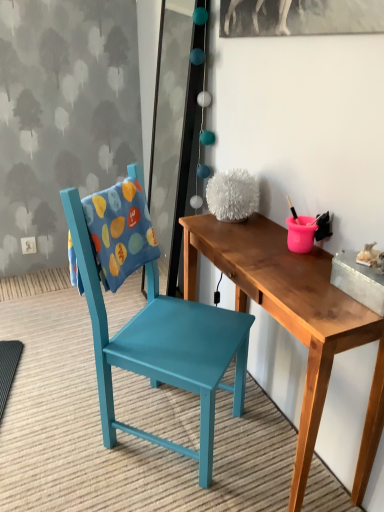
At what (x,y) coordinates should I click in order to perform the action: click on free point above wooden table at center (from a real-world perspective). Please return your answer as a coordinate pair (x, y). Looking at the image, I should click on (291, 263).